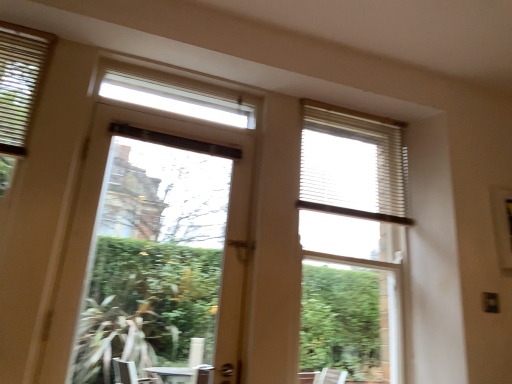
Question: Could you tell me if white textured blind at upper right is turned towards white textured blinds at upper right?

Choices:
 (A) yes
 (B) no

Answer: (A)

Question: Is white textured blind at upper right shorter than white textured blinds at upper right?

Choices:
 (A) yes
 (B) no

Answer: (A)

Question: Would you say white textured blind at upper right is outside white textured blinds at upper right?

Choices:
 (A) yes
 (B) no

Answer: (B)

Question: Is white textured blind at upper right positioned far away from white textured blinds at upper right?

Choices:
 (A) no
 (B) yes

Answer: (A)

Question: Can you see white textured blind at upper right touching white textured blinds at upper right?

Choices:
 (A) no
 (B) yes

Answer: (A)

Question: Is point (11, 104) closer or farther from the camera than point (145, 233)?

Choices:
 (A) closer
 (B) farther

Answer: (A)

Question: Is matte white blinds at upper left wider or thinner than clear glass window at left?

Choices:
 (A) wide
 (B) thin

Answer: (B)

Question: From the image's perspective, is matte white blinds at upper left located above or below clear glass window at left?

Choices:
 (A) below
 (B) above

Answer: (B)

Question: In the image, is matte white blinds at upper left positioned in front of or behind clear glass window at left?

Choices:
 (A) front
 (B) behind

Answer: (B)

Question: Would you say clear glass window at left is to the left or to the right of white textured blinds at upper right in the picture?

Choices:
 (A) left
 (B) right

Answer: (A)

Question: Does point (123, 196) appear closer or farther from the camera than point (380, 145)?

Choices:
 (A) closer
 (B) farther

Answer: (B)

Question: Looking at their shapes, would you say clear glass window at left is wider or thinner than white textured blinds at upper right?

Choices:
 (A) wide
 (B) thin

Answer: (A)

Question: Considering their positions, is clear glass window at left located in front of or behind white textured blinds at upper right?

Choices:
 (A) behind
 (B) front

Answer: (B)

Question: Based on their sizes in the image, would you say clear glass window at left is bigger or smaller than white textured blind at upper right?

Choices:
 (A) big
 (B) small

Answer: (A)

Question: From a real-world perspective, relative to white textured blind at upper right, is clear glass window at left vertically above or below?

Choices:
 (A) below
 (B) above

Answer: (A)